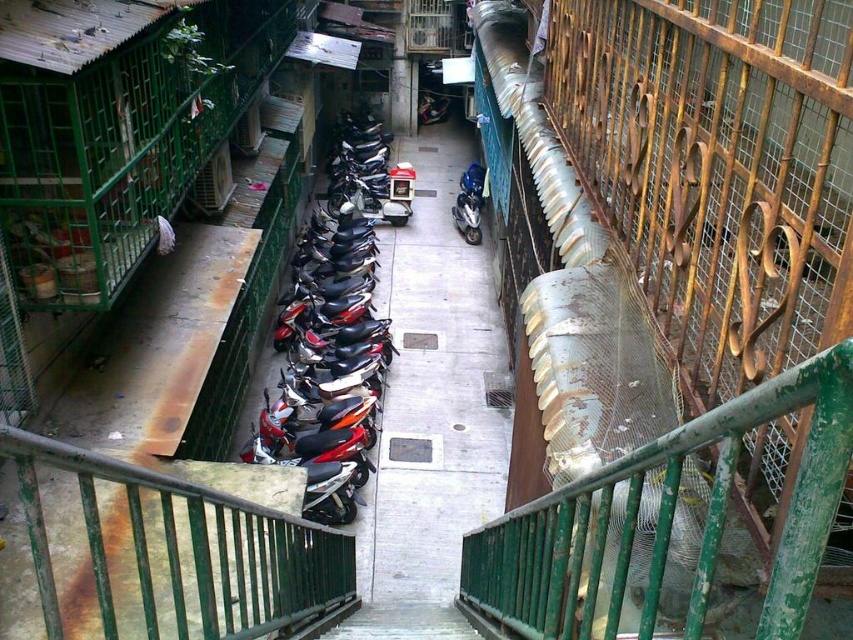
Question: Among these objects, which one is nearest to the camera?

Choices:
 (A) blue metallic motorcycle at center
 (B) shiny metallic motorcycle at center

Answer: (B)

Question: Which of these objects is positioned farthest from the blue metallic motorcycle at center?

Choices:
 (A) green painted metal railing at upper right
 (B) shiny metallic motorcycle at center

Answer: (A)

Question: Does green painted metal railing at upper right have a greater width compared to blue metallic motorcycle at center?

Choices:
 (A) no
 (B) yes

Answer: (A)

Question: Can you confirm if shiny metallic motorcycle at center is thinner than blue metallic motorcycle at center?

Choices:
 (A) yes
 (B) no

Answer: (B)

Question: Observing the image, what is the correct spatial positioning of green painted metal railing at upper right in reference to blue metallic motorcycle at center?

Choices:
 (A) above
 (B) below

Answer: (B)

Question: Among these objects, which one is nearest to the camera?

Choices:
 (A) shiny metallic motorcycle at center
 (B) blue metallic motorcycle at center
 (C) green painted metal railing at upper right

Answer: (C)